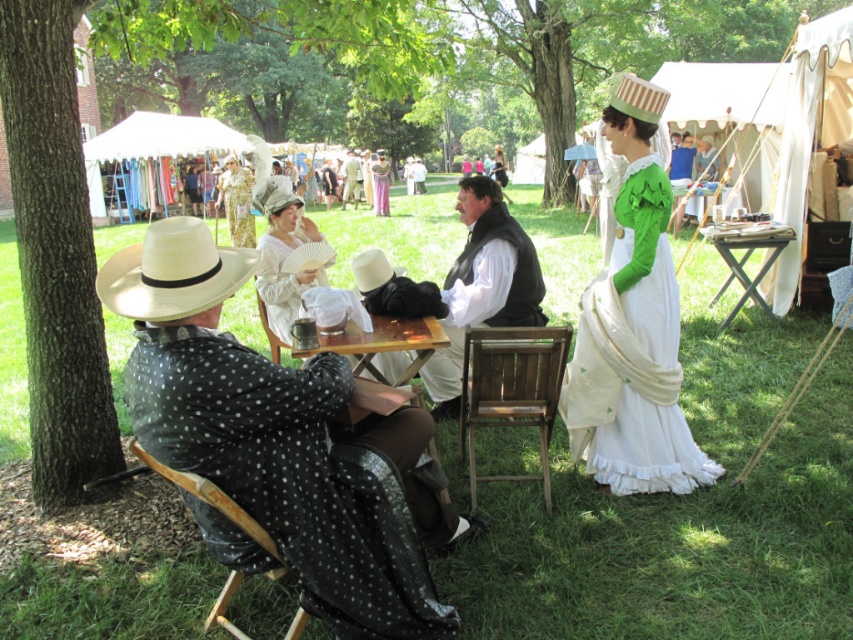
Does white cotton vest at center have a lesser width compared to light beige fabric hat at center?

No.

Does point (457, 358) lie behind point (357, 204)?

No, (457, 358) is closer to viewer.

Image resolution: width=853 pixels, height=640 pixels. Find the location of `white cotton vest at center`. white cotton vest at center is located at coordinates (483, 285).

Does black dotted fabric at left appear on the left side of green leafy tree at left?

In fact, black dotted fabric at left is to the right of green leafy tree at left.

Between black dotted fabric at left and green leafy tree at left, which one has less height?

Standing shorter between the two is black dotted fabric at left.

Does point (192, 339) come closer to viewer compared to point (49, 208)?

That is True.

Where is `black dotted fabric at left`? black dotted fabric at left is located at coordinates (274, 436).

Is green leafy tree at left to the right of blue fabric at center from the viewer's perspective?

In fact, green leafy tree at left is to the left of blue fabric at center.

Does point (50, 132) lie behind point (672, 220)?

No, it is not.

Locate an element on the screen. Image resolution: width=853 pixels, height=640 pixels. green leafy tree at left is located at coordinates (54, 252).